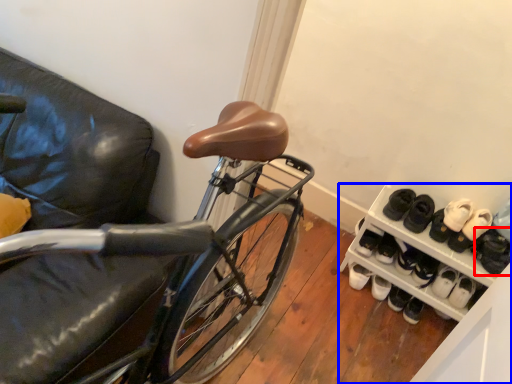
Question: Which object appears closest to the camera in this image, footwear (highlighted by a red box) or cabinetry (highlighted by a blue box)?

Choices:
 (A) footwear
 (B) cabinetry

Answer: (B)